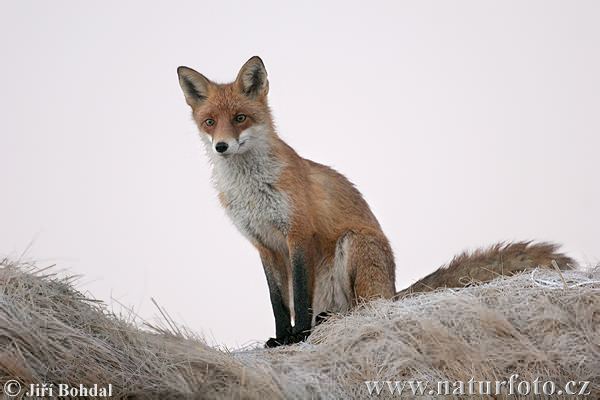
Identify the location of white chest. [248, 196].